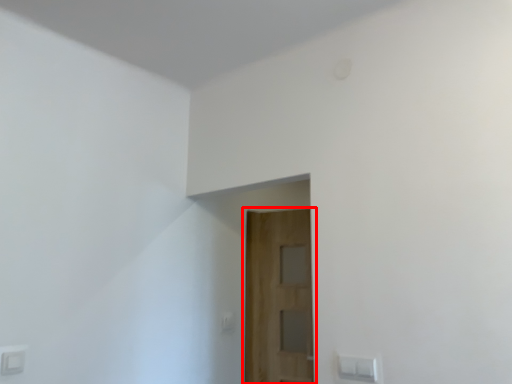
Question: From the image's perspective, where is door (annotated by the red box) located in relation to light switch in the image?

Choices:
 (A) below
 (B) above

Answer: (B)